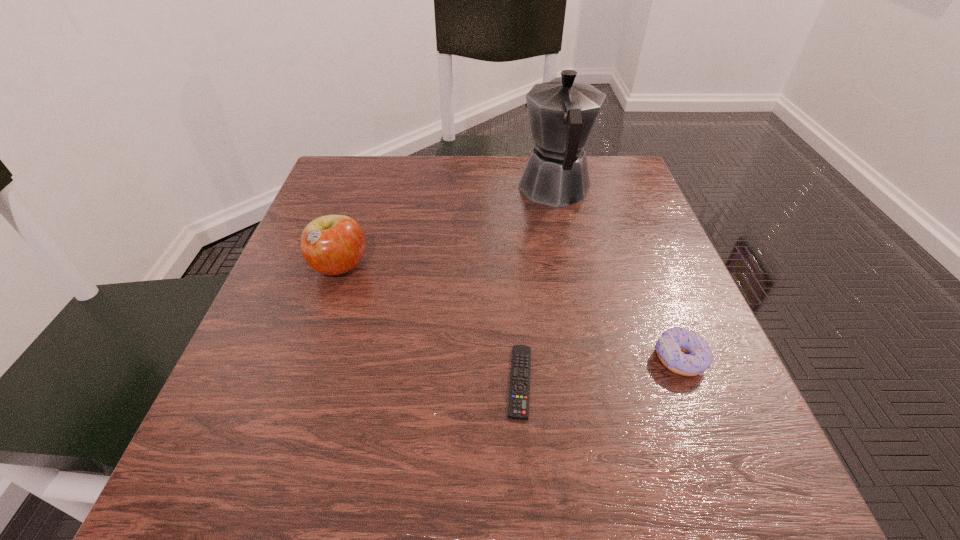
At what (x,y) coordinates should I click in order to perform the action: click on the tallest object. Please return your answer as a coordinate pair (x, y). Looking at the image, I should click on (562, 113).

The height and width of the screenshot is (540, 960). Find the location of `coffeepot`. coffeepot is located at coordinates (562, 113).

Find the location of a particular element. the leftmost object is located at coordinates point(332,244).

Image resolution: width=960 pixels, height=540 pixels. Identify the location of the third nearest object. (332, 244).

Image resolution: width=960 pixels, height=540 pixels. I want to click on doughnut, so click(670, 347).

I want to click on the rightmost object, so click(670, 347).

Image resolution: width=960 pixels, height=540 pixels. I want to click on the second object from left to right, so click(519, 394).

The image size is (960, 540). Identify the location of remote control. (519, 394).

Locate an element on the screen. free spot located on the front of the second tallest object is located at coordinates (297, 400).

Where is `free point located on the back of the rightmost object`? free point located on the back of the rightmost object is located at coordinates (628, 227).